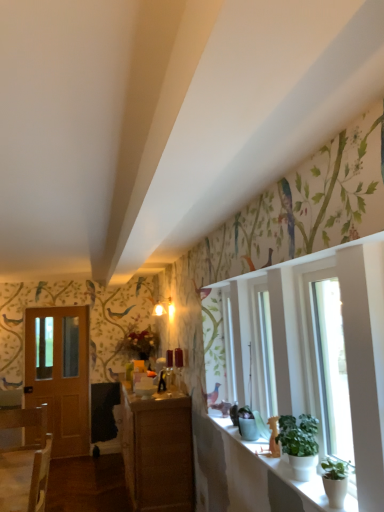
Question: From a real-world perspective, is transparent glass window at right below white ceramic window sill at lower right?

Choices:
 (A) no
 (B) yes

Answer: (A)

Question: Considering the relative sizes of transparent glass window at right and white ceramic window sill at lower right in the image provided, is transparent glass window at right smaller than white ceramic window sill at lower right?

Choices:
 (A) yes
 (B) no

Answer: (B)

Question: Considering the relative sizes of transparent glass window at right and white ceramic window sill at lower right in the image provided, is transparent glass window at right taller than white ceramic window sill at lower right?

Choices:
 (A) yes
 (B) no

Answer: (A)

Question: From the image's perspective, is transparent glass window at right beneath white ceramic window sill at lower right?

Choices:
 (A) yes
 (B) no

Answer: (B)

Question: Is transparent glass window at right further to the viewer compared to white ceramic window sill at lower right?

Choices:
 (A) no
 (B) yes

Answer: (B)

Question: In terms of width, does transparent glass window at right look wider or thinner when compared to green matte plant at lower right, the 1th houseplant positioned from the front?

Choices:
 (A) thin
 (B) wide

Answer: (B)

Question: From a real-world perspective, is transparent glass window at right above or below green matte plant at lower right, the second houseplant from the back?

Choices:
 (A) below
 (B) above

Answer: (B)

Question: Relative to green matte plant at lower right, the 1th houseplant positioned from the front, is transparent glass window at right in front or behind?

Choices:
 (A) behind
 (B) front

Answer: (B)

Question: Is transparent glass window at right bigger or smaller than green matte plant at lower right, the second houseplant from the back?

Choices:
 (A) small
 (B) big

Answer: (B)

Question: Choose the correct answer: Is white ceramic window sill at lower right inside green matte plant at lower right, the 1th houseplant positioned from the front, or outside it?

Choices:
 (A) outside
 (B) inside

Answer: (A)

Question: From a real-world perspective, relative to green matte plant at lower right, the second houseplant from the back, is white ceramic window sill at lower right vertically above or below?

Choices:
 (A) below
 (B) above

Answer: (A)

Question: From the image's perspective, is white ceramic window sill at lower right positioned above or below green matte plant at lower right, the 1th houseplant positioned from the front?

Choices:
 (A) above
 (B) below

Answer: (B)

Question: Considering their positions, is white ceramic window sill at lower right located in front of or behind green matte plant at lower right, the 1th houseplant positioned from the front?

Choices:
 (A) behind
 (B) front

Answer: (B)

Question: Would you say transparent glass window at right is inside or outside wooden cabinet at center?

Choices:
 (A) outside
 (B) inside

Answer: (A)

Question: In the image, is transparent glass window at right positioned in front of or behind wooden cabinet at center?

Choices:
 (A) behind
 (B) front

Answer: (B)